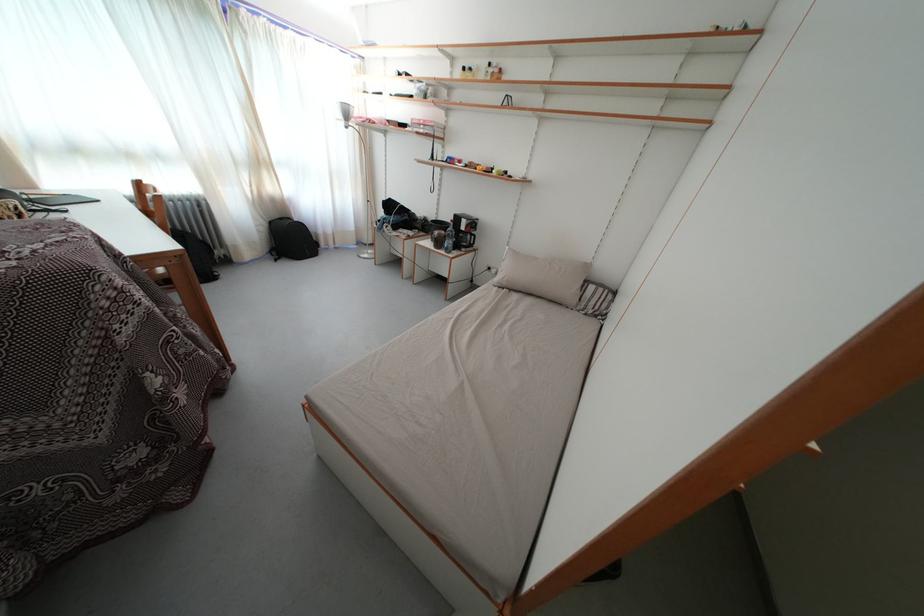
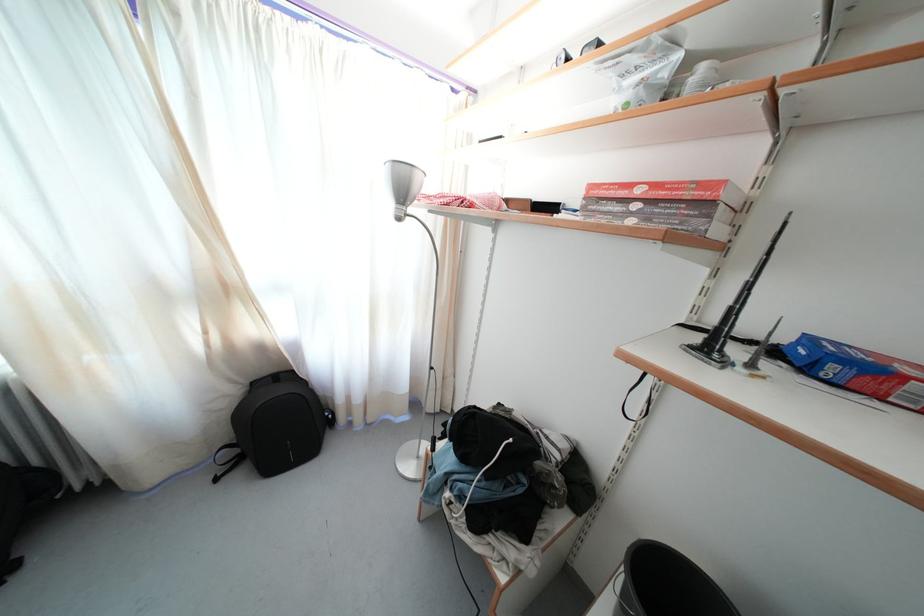
Find the pixel in the second image that matches pixel 276 229 in the first image.

(259, 390)